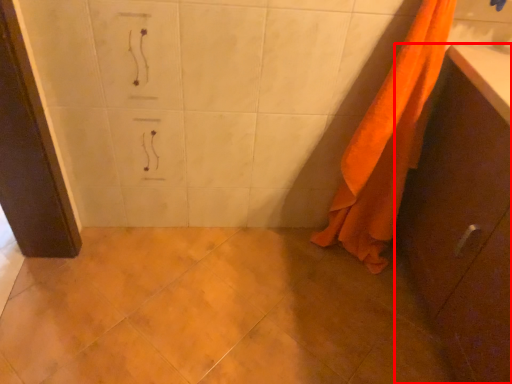
Question: From the image, what is the correct spatial relationship of bathroom cabinet (annotated by the red box) in relation to towel?

Choices:
 (A) right
 (B) left

Answer: (A)